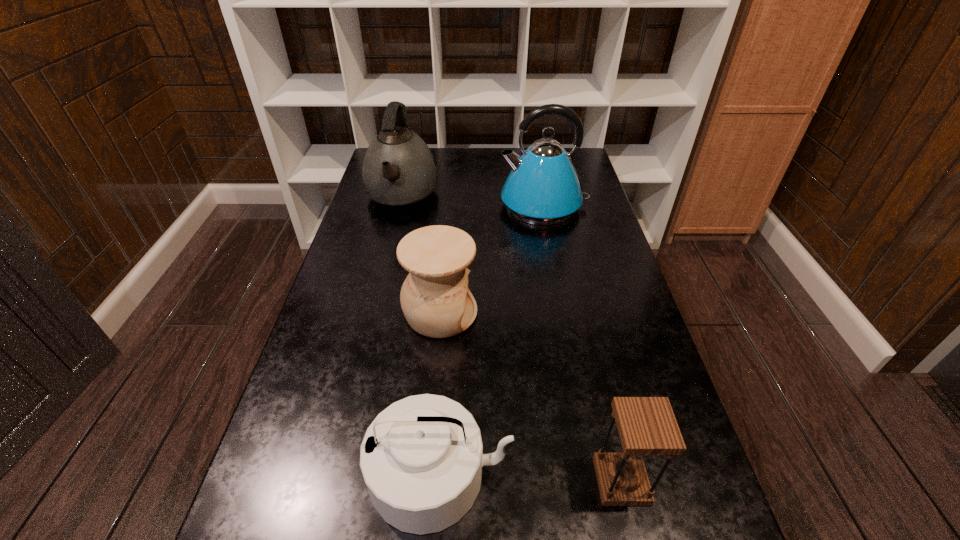
Locate an element on the screen. This screenshot has height=540, width=960. object at the left edge is located at coordinates (399, 173).

Find the location of a particular element. kettle located at the right edge is located at coordinates (543, 188).

This screenshot has width=960, height=540. What are the coordinates of `hourglass that is positioned at the right edge` in the screenshot? It's located at (647, 426).

Image resolution: width=960 pixels, height=540 pixels. I want to click on object that is at the far left corner, so click(399, 173).

This screenshot has width=960, height=540. In order to click on free space at the left edge in this screenshot , I will do `click(374, 238)`.

The image size is (960, 540). Find the location of `free region at the right edge of the desktop`. free region at the right edge of the desktop is located at coordinates (590, 238).

The height and width of the screenshot is (540, 960). I want to click on vacant position at the far right corner of the desktop, so click(582, 168).

Locate an element on the screen. The height and width of the screenshot is (540, 960). vacant area that lies between the pottery and the hourglass is located at coordinates (531, 397).

Image resolution: width=960 pixels, height=540 pixels. I want to click on vacant space that is in between the rightmost kettle and the hourglass, so click(583, 343).

Where is `free space that is in between the rightmost kettle and the pottery`? free space that is in between the rightmost kettle and the pottery is located at coordinates (492, 259).